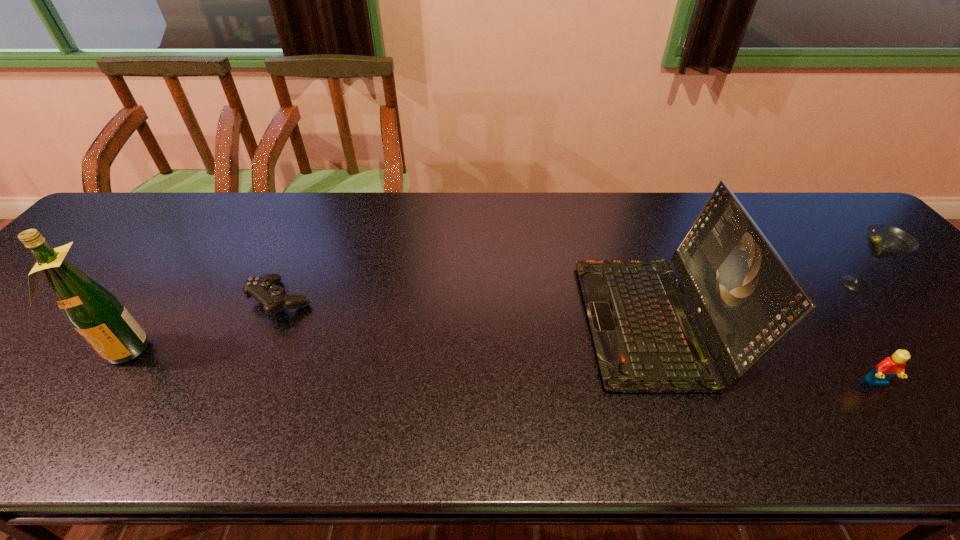
The image size is (960, 540). In order to click on the leftmost object in this screenshot , I will do `click(94, 311)`.

Locate an element on the screen. The width and height of the screenshot is (960, 540). the tallest object is located at coordinates (94, 311).

Find the location of a particular element. the third object from right to left is located at coordinates (746, 300).

Identify the location of laptop computer. (746, 300).

At what (x,y) coordinates should I click in order to perform the action: click on the rightmost object. Please return your answer as a coordinate pair (x, y). Looking at the image, I should click on (884, 241).

Where is `the third tallest object`? The width and height of the screenshot is (960, 540). the third tallest object is located at coordinates (884, 241).

Identify the location of Lego. The image size is (960, 540). (889, 367).

Image resolution: width=960 pixels, height=540 pixels. Find the location of `the second object from right to left`. the second object from right to left is located at coordinates (889, 367).

This screenshot has width=960, height=540. Identify the location of the shortest object. (264, 289).

You are a GUI agent. You are given a task and a screenshot of the screen. Output one action in this format:
    pyautogui.click(x=<x>, y=<y>)
    Task: Click on the second object from left to right
    This screenshot has height=540, width=960.
    Given the screenshot: What is the action you would take?
    pyautogui.click(x=264, y=289)